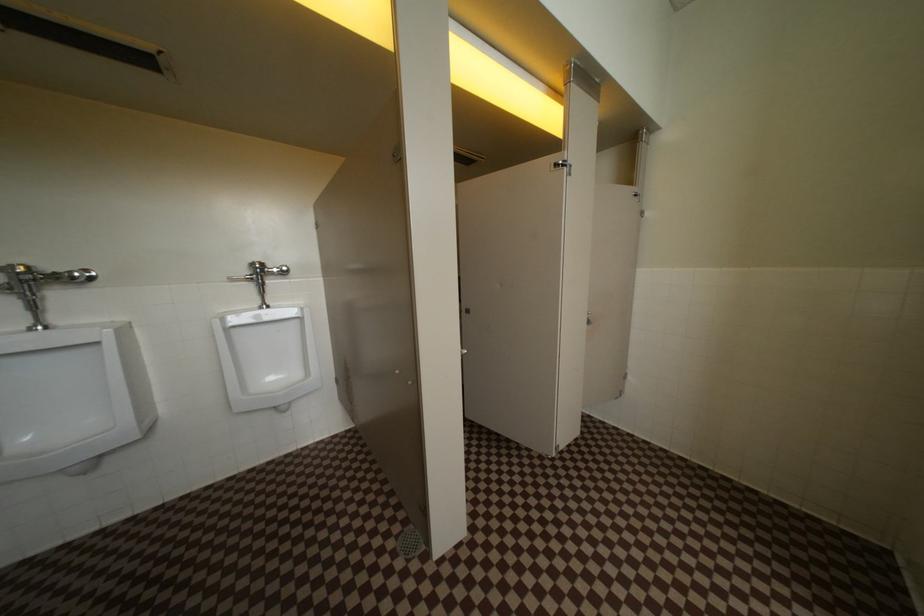
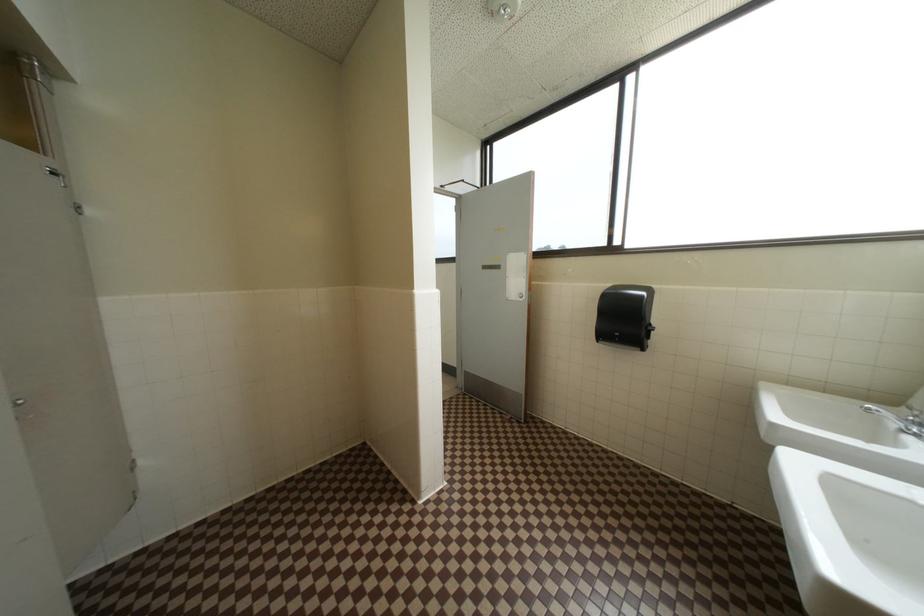
Question: Based on the continuous images, in which direction is the camera rotating? Reply with the corresponding letter.

Choices:
 (A) Left
 (B) Right
 (C) Up
 (D) Down

Answer: (B)